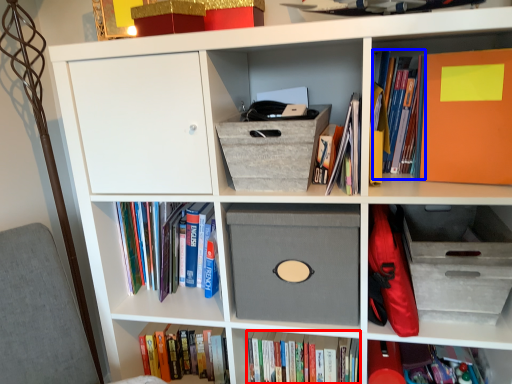
Question: Which object is further to the camera taking this photo, book (highlighted by a red box) or book (highlighted by a blue box)?

Choices:
 (A) book
 (B) book

Answer: (A)